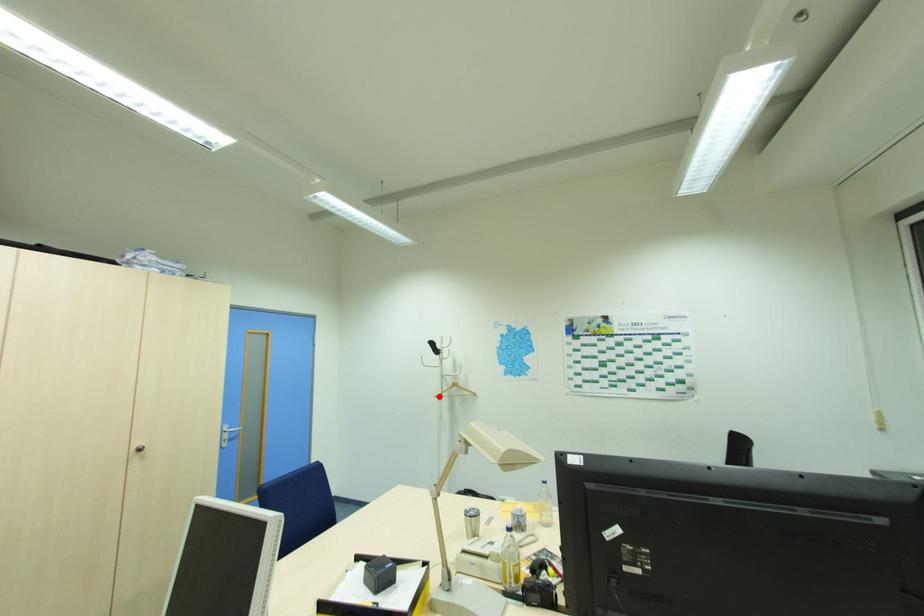
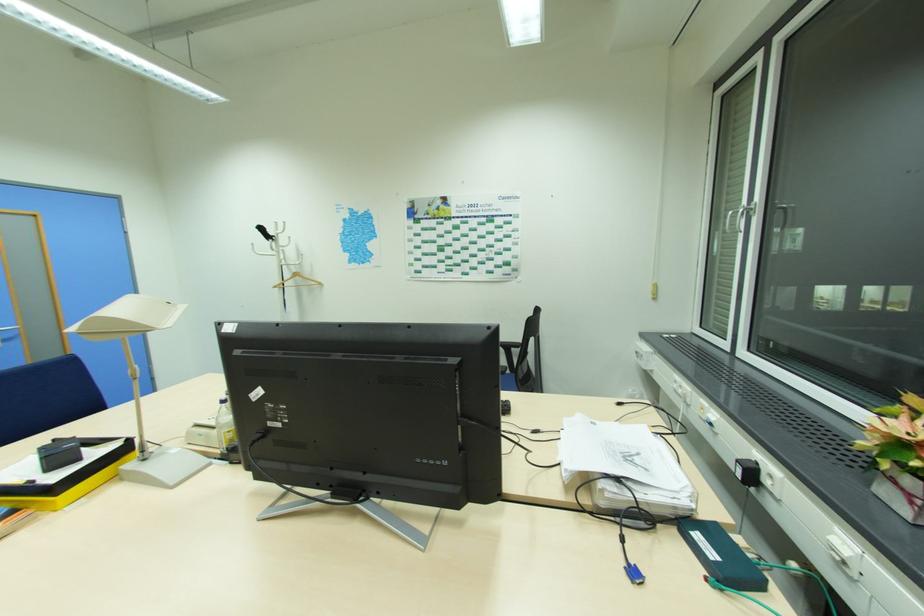
Question: I am providing you with two images of the same scene from different viewpoints. Given a red point in image1, look at the same physical point in image2. Is it:

Choices:
 (A) Closer to the viewpoint
 (B) Farther from the viewpoint

Answer: (A)